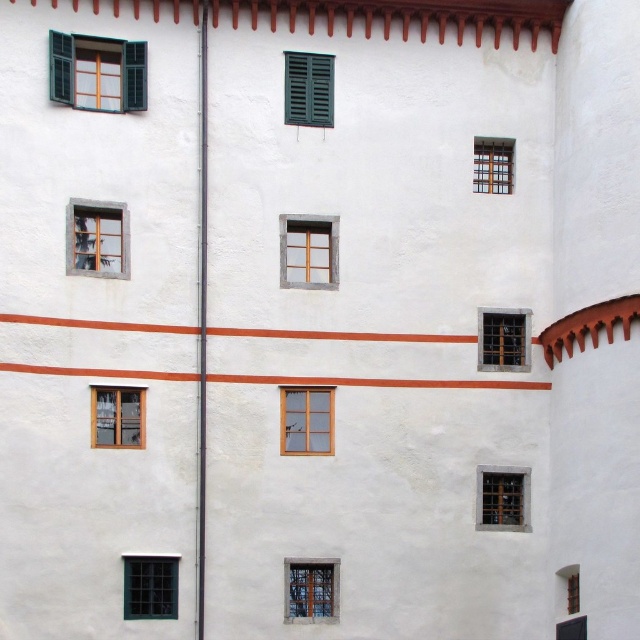
Between point (486, 484) and point (506, 144), which one is positioned behind?

The point (506, 144) is more distant.

The image size is (640, 640). Find the location of `matte glass window at lower right`. matte glass window at lower right is located at coordinates point(502,499).

Can you confirm if clear glass window at center is shorter than wooden frame at lower left?

Incorrect, clear glass window at center's height does not fall short of wooden frame at lower left's.

Does point (305, 609) come behind point (120, 429)?

Yes, it is behind point (120, 429).

The width and height of the screenshot is (640, 640). What are the coordinates of `clear glass window at center` in the screenshot? It's located at [x=310, y=589].

Is point (296, 451) less distant than point (100, 401)?

No, (296, 451) is behind (100, 401).

What do you see at coordinates (307, 420) in the screenshot? The image size is (640, 640). I see `wooden window at center` at bounding box center [307, 420].

Between point (292, 396) and point (124, 444), which one is positioned behind?

Point (292, 396)

Identify the location of wooden window at center. (307, 420).